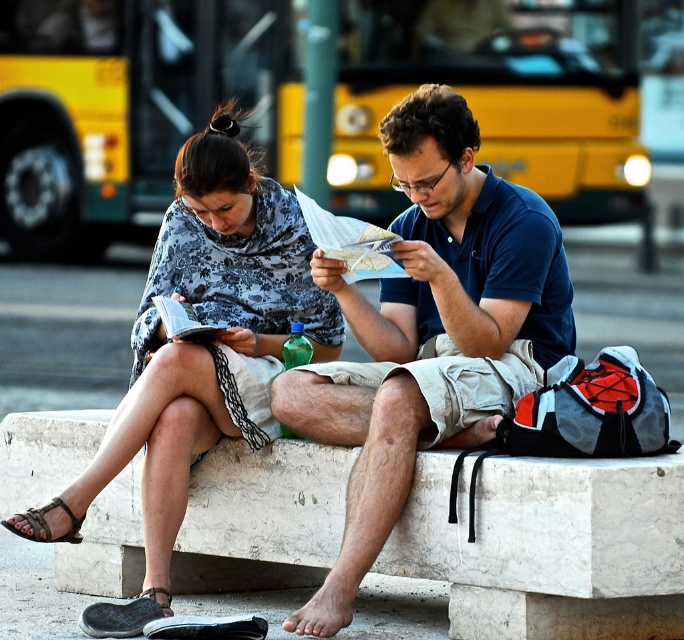
Question: Is yellow metallic bus at upper center positioned in front of floral fabric scarf at upper left?

Choices:
 (A) no
 (B) yes

Answer: (A)

Question: Based on their relative distances, which object is farther from the blue cotton shirt at center?

Choices:
 (A) floral fabric scarf at upper left
 (B) white marble bench at center
 (C) yellow metallic bus at upper center

Answer: (C)

Question: Which object is the farthest from the blue cotton shirt at center?

Choices:
 (A) white marble bench at center
 (B) floral fabric scarf at upper left
 (C) yellow metallic bus at upper center

Answer: (C)

Question: Is the position of yellow metallic bus at upper center more distant than that of floral fabric scarf at upper left?

Choices:
 (A) no
 (B) yes

Answer: (B)

Question: Based on their relative distances, which object is nearer to the white marble bench at center?

Choices:
 (A) floral fabric scarf at upper left
 (B) blue cotton shirt at center

Answer: (A)

Question: Is white marble bench at center bigger than blue cotton shirt at center?

Choices:
 (A) no
 (B) yes

Answer: (A)